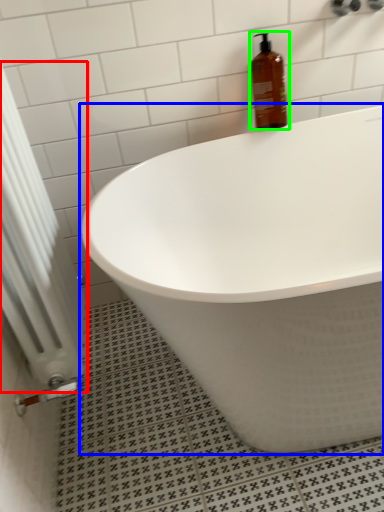
Question: Based on their relative distances, which object is nearer to radiator (highlighted by a red box)? Choose from bathtub (highlighted by a blue box) and bottle (highlighted by a green box).

Choices:
 (A) bathtub
 (B) bottle

Answer: (A)